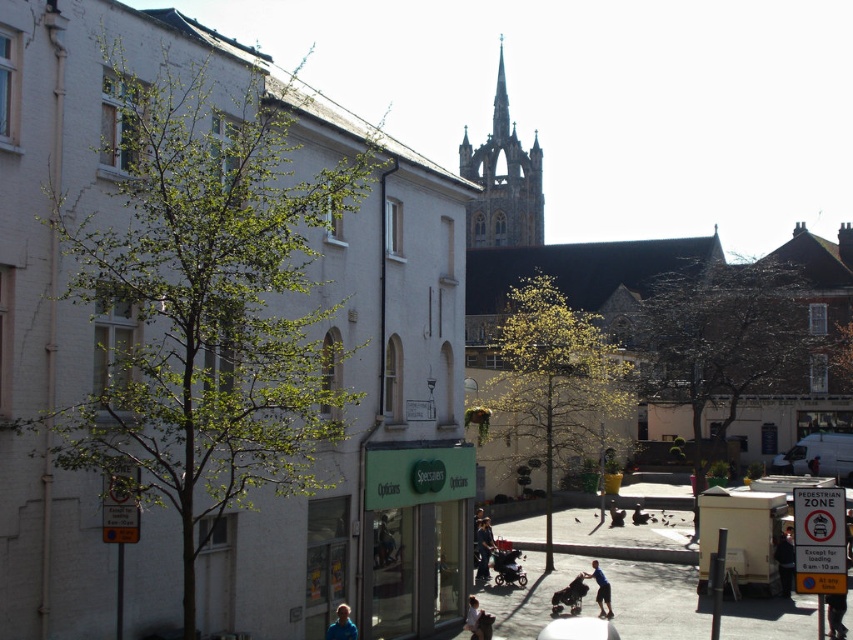
Question: Among these points, which one is farthest from the camera?

Choices:
 (A) pos(335,625)
 (B) pos(495,104)

Answer: (B)

Question: Is green leafy tree at center to the left of blue fabric at lower center from the viewer's perspective?

Choices:
 (A) yes
 (B) no

Answer: (B)

Question: Is brown textured tree at center smaller than dark blue jeans at center?

Choices:
 (A) no
 (B) yes

Answer: (A)

Question: Which point appears farthest from the camera in this image?

Choices:
 (A) (480, 545)
 (B) (524, 369)

Answer: (B)

Question: Which object is positioned farthest from the stone gothic spire at upper center?

Choices:
 (A) light blue shirt at lower center
 (B) blue fabric shirt at lower right
 (C) blue fabric at lower center

Answer: (C)

Question: Can you confirm if green leafy tree at center is positioned to the left of stone gothic spire at upper center?

Choices:
 (A) no
 (B) yes

Answer: (B)